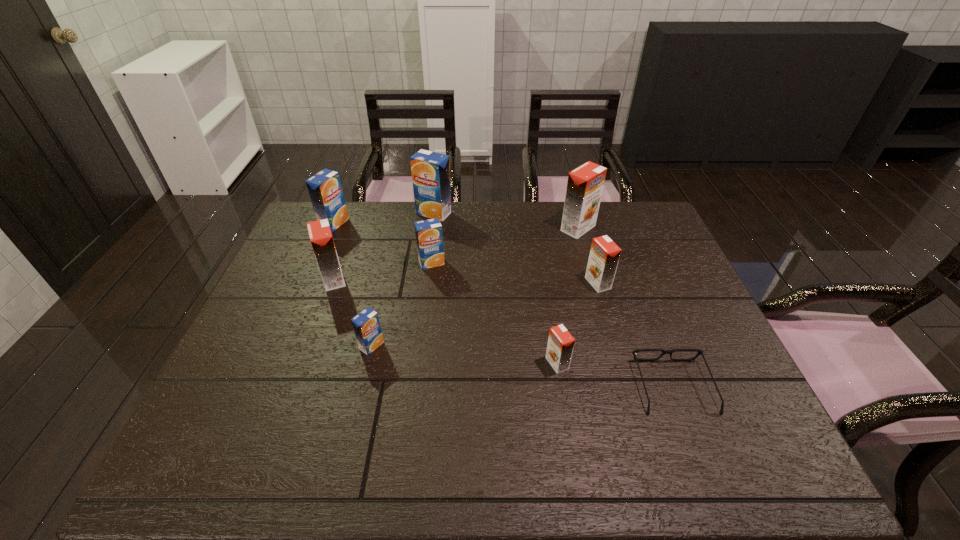
The image size is (960, 540). In order to click on the biggest orange orange juice in this screenshot , I will do `click(585, 184)`.

Where is `the biggest blue orange_juice`? Image resolution: width=960 pixels, height=540 pixels. the biggest blue orange_juice is located at coordinates (430, 171).

The width and height of the screenshot is (960, 540). Identify the location of the third smallest blue orange_juice. (325, 190).

Find the location of `the leftmost orange orange juice`. the leftmost orange orange juice is located at coordinates (321, 239).

Where is `the third farthest blue orange_juice`? the third farthest blue orange_juice is located at coordinates (429, 236).

Find the location of `the second smallest orange orange juice`. the second smallest orange orange juice is located at coordinates (604, 255).

This screenshot has height=540, width=960. I want to click on the third object from left to right, so click(x=366, y=325).

Identify the location of the nearest blue orange_juice. This screenshot has height=540, width=960. (366, 325).

What are the coordinates of `the smallest orange orange juice` in the screenshot? It's located at (560, 345).

Where is `the nearest orange orange juice`? The image size is (960, 540). the nearest orange orange juice is located at coordinates (560, 345).